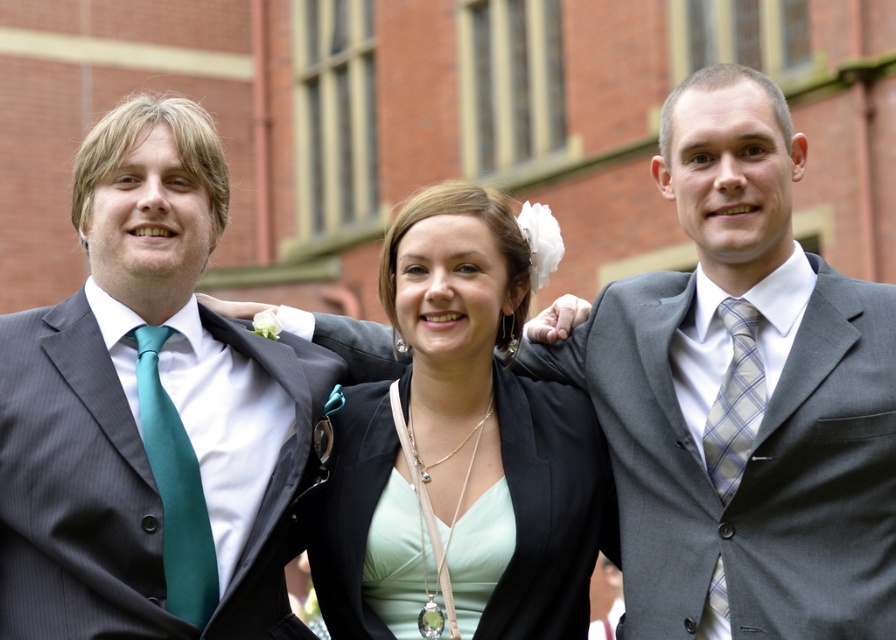
Question: Observing the image, what is the correct spatial positioning of teal satin tie at left in reference to gray plaid tie at right?

Choices:
 (A) above
 (B) below

Answer: (B)

Question: Which object appears closest to the camera in this image?

Choices:
 (A) green satin dress at center
 (B) teal satin tie at left
 (C) matte black blazer at center
 (D) matte black suit at left

Answer: (D)

Question: Among these objects, which one is nearest to the camera?

Choices:
 (A) teal satin tie at left
 (B) matte black suit at left
 (C) matte black blazer at center

Answer: (B)

Question: Can you confirm if green satin dress at center is positioned above teal satin tie at left?

Choices:
 (A) yes
 (B) no

Answer: (B)

Question: Is matte black suit at left positioned behind gray plaid tie at right?

Choices:
 (A) no
 (B) yes

Answer: (A)

Question: Which is nearer to the gray plaid tie at right?

Choices:
 (A) green satin dress at center
 (B) teal satin tie at left

Answer: (A)